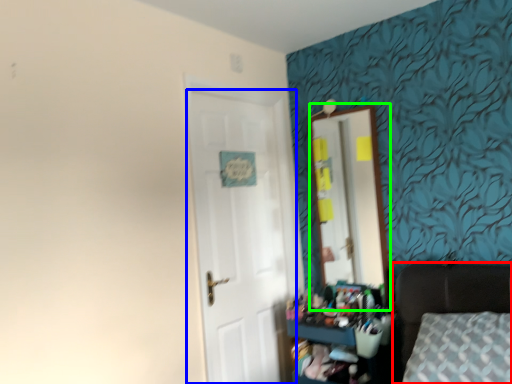
Question: Considering the real-world distances, which object is closest to furniture (highlighted by a red box)? door (highlighted by a blue box) or mirror (highlighted by a green box).

Choices:
 (A) door
 (B) mirror

Answer: (B)